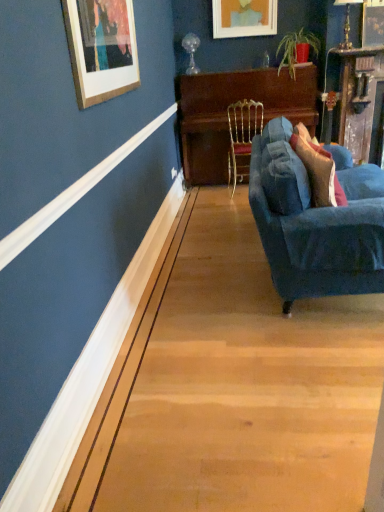
Locate an element on the screen. free location to the left of wooden picture frame at upper right, the second picture frame in the left-to-right sequence is located at coordinates (353, 53).